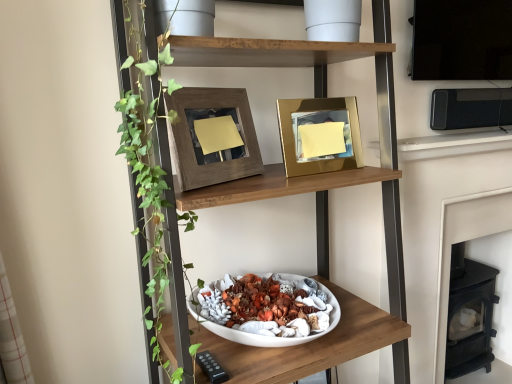
How much space does wooden bowl at center, marked as the first shelf in a top-to-bottom arrangement, occupy horizontally?

wooden bowl at center, marked as the first shelf in a top-to-bottom arrangement, is 19.04 inches wide.

Locate an element on the screen. The image size is (512, 384). wooden frame at upper center, which appears as the second picture frame when viewed from the right is located at coordinates (191, 139).

What do you see at coordinates (191, 139) in the screenshot?
I see `wooden frame at upper center, which ranks as the first picture frame in left-to-right order` at bounding box center [191, 139].

Describe the element at coordinates (470, 108) in the screenshot. I see `black plastic microwave at upper right` at that location.

This screenshot has height=384, width=512. Identify the location of gold metallic picture frame at upper center, the second picture frame when ordered from left to right. pyautogui.click(x=319, y=135).

Can you confirm if black cast iron fireplace at lower right is thinner than wooden bowl at center, marked as the first shelf in a top-to-bottom arrangement?

Yes.

Between black cast iron fireplace at lower right and wooden bowl at center, marked as the first shelf in a top-to-bottom arrangement, which one appears on the left side from the viewer's perspective?

wooden bowl at center, marked as the first shelf in a top-to-bottom arrangement, is more to the left.

Is black cast iron fireplace at lower right positioned beyond the bounds of wooden bowl at center, which is counted as the second shelf, starting from the bottom?

Absolutely, black cast iron fireplace at lower right is external to wooden bowl at center, which is counted as the second shelf, starting from the bottom.

Is black cast iron fireplace at lower right taller or shorter than wooden bowl at center, marked as the first shelf in a top-to-bottom arrangement?

Clearly, black cast iron fireplace at lower right is shorter compared to wooden bowl at center, marked as the first shelf in a top-to-bottom arrangement.

Considering the sizes of gold metallic picture frame at upper center, the second picture frame when ordered from left to right, and white matte bowl at center, which appears as the second shelf when viewed from the top, in the image, is gold metallic picture frame at upper center, the second picture frame when ordered from left to right, bigger or smaller than white matte bowl at center, which appears as the second shelf when viewed from the top,?

Considering their sizes, gold metallic picture frame at upper center, the second picture frame when ordered from left to right, takes up less space than white matte bowl at center, which appears as the second shelf when viewed from the top.

Would you say gold metallic picture frame at upper center, the first picture frame positioned from the right, is to the left or to the right of white matte bowl at center, which appears as the second shelf when viewed from the top, in the picture?

From the image, it's evident that gold metallic picture frame at upper center, the first picture frame positioned from the right, is to the right of white matte bowl at center, which appears as the second shelf when viewed from the top.

Is gold metallic picture frame at upper center, the first picture frame positioned from the right, wider than white matte bowl at center, which is counted as the first shelf, starting from the bottom?

No.

Can you tell me how much gold metallic picture frame at upper center, the second picture frame when ordered from left to right, and white matte bowl at center, which appears as the second shelf when viewed from the top, differ in facing direction?

The angle between the facing direction of gold metallic picture frame at upper center, the second picture frame when ordered from left to right, and the facing direction of white matte bowl at center, which appears as the second shelf when viewed from the top, is 3.2 degrees.

Which is more to the right, wooden frame at upper center, which appears as the second picture frame when viewed from the right, or gold metallic picture frame at upper center, the second picture frame when ordered from left to right?

gold metallic picture frame at upper center, the second picture frame when ordered from left to right, is more to the right.

Does wooden frame at upper center, which appears as the second picture frame when viewed from the right, have a lesser width compared to gold metallic picture frame at upper center, the second picture frame when ordered from left to right?

Yes.

From the image's perspective, which one is positioned lower, wooden frame at upper center, which appears as the second picture frame when viewed from the right, or gold metallic picture frame at upper center, the second picture frame when ordered from left to right?

From the image's view, wooden frame at upper center, which appears as the second picture frame when viewed from the right, is below.

From a real-world perspective, is wooden frame at upper center, which ranks as the first picture frame in left-to-right order, positioned over gold metallic picture frame at upper center, the first picture frame positioned from the right, based on gravity?

Yes, from a real-world perspective, wooden frame at upper center, which ranks as the first picture frame in left-to-right order, is on top of gold metallic picture frame at upper center, the first picture frame positioned from the right.

Is gold metallic picture frame at upper center, the second picture frame when ordered from left to right, surrounding wooden frame at upper center, which ranks as the first picture frame in left-to-right order?

No, wooden frame at upper center, which ranks as the first picture frame in left-to-right order, is not a part of gold metallic picture frame at upper center, the second picture frame when ordered from left to right.

Is gold metallic picture frame at upper center, the second picture frame when ordered from left to right, thinner than wooden frame at upper center, which appears as the second picture frame when viewed from the right?

In fact, gold metallic picture frame at upper center, the second picture frame when ordered from left to right, might be wider than wooden frame at upper center, which appears as the second picture frame when viewed from the right.

Considering the sizes of gold metallic picture frame at upper center, the first picture frame positioned from the right, and wooden frame at upper center, which ranks as the first picture frame in left-to-right order, in the image, is gold metallic picture frame at upper center, the first picture frame positioned from the right, bigger or smaller than wooden frame at upper center, which ranks as the first picture frame in left-to-right order,?

In the image, gold metallic picture frame at upper center, the first picture frame positioned from the right, appears to be smaller than wooden frame at upper center, which ranks as the first picture frame in left-to-right order.

Would you say gold metallic picture frame at upper center, the second picture frame when ordered from left to right, is to the left or to the right of wooden frame at upper center, which ranks as the first picture frame in left-to-right order, in the picture?

Based on their positions, gold metallic picture frame at upper center, the second picture frame when ordered from left to right, is located to the right of wooden frame at upper center, which ranks as the first picture frame in left-to-right order.

Is wooden bowl at center, which is counted as the second shelf, starting from the bottom, not inside wooden frame at upper center, which appears as the second picture frame when viewed from the right?

Indeed, wooden bowl at center, which is counted as the second shelf, starting from the bottom, is completely outside wooden frame at upper center, which appears as the second picture frame when viewed from the right.

Is wooden bowl at center, which is counted as the second shelf, starting from the bottom, oriented towards wooden frame at upper center, which ranks as the first picture frame in left-to-right order?

Yes, wooden bowl at center, which is counted as the second shelf, starting from the bottom, is turned towards wooden frame at upper center, which ranks as the first picture frame in left-to-right order.

Looking at their sizes, would you say wooden bowl at center, which is counted as the second shelf, starting from the bottom, is wider or thinner than wooden frame at upper center, which appears as the second picture frame when viewed from the right?

In the image, wooden bowl at center, which is counted as the second shelf, starting from the bottom, appears to be wider than wooden frame at upper center, which appears as the second picture frame when viewed from the right.

Is wooden bowl at center, marked as the first shelf in a top-to-bottom arrangement, bigger than wooden frame at upper center, which appears as the second picture frame when viewed from the right?

Yes, wooden bowl at center, marked as the first shelf in a top-to-bottom arrangement, is bigger than wooden frame at upper center, which appears as the second picture frame when viewed from the right.

Find the location of a particular element. The width and height of the screenshot is (512, 384). picture frame that is the 2nd one above the white matte bowl at center, which is counted as the first shelf, starting from the bottom (from a real-world perspective) is located at coordinates (191, 139).

From a real-world perspective, is white matte bowl at center, which appears as the second shelf when viewed from the top, above or below wooden frame at upper center, which ranks as the first picture frame in left-to-right order?

white matte bowl at center, which appears as the second shelf when viewed from the top, is below wooden frame at upper center, which ranks as the first picture frame in left-to-right order.

From the image's perspective, between white matte bowl at center, which appears as the second shelf when viewed from the top, and wooden frame at upper center, which appears as the second picture frame when viewed from the right, which one is located above?

wooden frame at upper center, which appears as the second picture frame when viewed from the right, appears higher in the image.

Does point (283, 361) appear closer or farther from the camera than point (229, 165)?

Clearly, point (283, 361) is closer to the camera than point (229, 165).

Could you measure the distance between black plastic microwave at upper right and white matte bowl at center, which appears as the second shelf when viewed from the top?

black plastic microwave at upper right is 87.21 centimeters from white matte bowl at center, which appears as the second shelf when viewed from the top.

In the image, is black plastic microwave at upper right on the left side or the right side of white matte bowl at center, which appears as the second shelf when viewed from the top?

black plastic microwave at upper right is to the right of white matte bowl at center, which appears as the second shelf when viewed from the top.

Are black plastic microwave at upper right and white matte bowl at center, which appears as the second shelf when viewed from the top, beside each other?

No, black plastic microwave at upper right is not with white matte bowl at center, which appears as the second shelf when viewed from the top.

Do you think black plastic microwave at upper right is within white matte bowl at center, which is counted as the first shelf, starting from the bottom, or outside of it?

black plastic microwave at upper right is located beyond the bounds of white matte bowl at center, which is counted as the first shelf, starting from the bottom.

Locate an element on the screen. This screenshot has width=512, height=384. fireplace that is behind the wooden bowl at center, marked as the first shelf in a top-to-bottom arrangement is located at coordinates 465,240.

I want to click on the 2nd shelf directly beneath the gold metallic picture frame at upper center, the first picture frame positioned from the right (from a real-world perspective), so click(x=307, y=343).

Considering their positions, is wooden bowl at center, marked as the first shelf in a top-to-bottom arrangement, positioned closer to wooden frame at upper center, which ranks as the first picture frame in left-to-right order, than white matte bowl at center, which appears as the second shelf when viewed from the top?

wooden bowl at center, marked as the first shelf in a top-to-bottom arrangement, is closer to wooden frame at upper center, which ranks as the first picture frame in left-to-right order.

Based on their spatial positions, is white matte bowl at center, which appears as the second shelf when viewed from the top, or wooden bowl at center, which is counted as the second shelf, starting from the bottom, further from black plastic microwave at upper right?

white matte bowl at center, which appears as the second shelf when viewed from the top.

Estimate the real-world distances between objects in this image. Which object is closer to wooden bowl at center, which is counted as the second shelf, starting from the bottom, wooden frame at upper center, which appears as the second picture frame when viewed from the right, or gold metallic picture frame at upper center, the second picture frame when ordered from left to right?

wooden frame at upper center, which appears as the second picture frame when viewed from the right, lies closer to wooden bowl at center, which is counted as the second shelf, starting from the bottom, than the other object.

Considering their positions, is white matte bowl at center, which appears as the second shelf when viewed from the top, positioned closer to wooden frame at upper center, which ranks as the first picture frame in left-to-right order, than black cast iron fireplace at lower right?

white matte bowl at center, which appears as the second shelf when viewed from the top, lies closer to wooden frame at upper center, which ranks as the first picture frame in left-to-right order, than the other object.

Which object lies further to the anchor point black plastic microwave at upper right, wooden frame at upper center, which appears as the second picture frame when viewed from the right, or gold metallic picture frame at upper center, the second picture frame when ordered from left to right?

wooden frame at upper center, which appears as the second picture frame when viewed from the right, is positioned further to the anchor black plastic microwave at upper right.

Estimate the real-world distances between objects in this image. Which object is closer to gold metallic picture frame at upper center, the first picture frame positioned from the right, wooden frame at upper center, which appears as the second picture frame when viewed from the right, or wooden bowl at center, which is counted as the second shelf, starting from the bottom?

wooden frame at upper center, which appears as the second picture frame when viewed from the right, is positioned closer to the anchor gold metallic picture frame at upper center, the first picture frame positioned from the right.

Estimate the real-world distances between objects in this image. Which object is closer to wooden frame at upper center, which ranks as the first picture frame in left-to-right order, wooden bowl at center, which is counted as the second shelf, starting from the bottom, or gold metallic picture frame at upper center, the second picture frame when ordered from left to right?

Based on the image, wooden bowl at center, which is counted as the second shelf, starting from the bottom, appears to be nearer to wooden frame at upper center, which ranks as the first picture frame in left-to-right order.

Looking at this image, looking at the image, which one is located further to wooden bowl at center, which is counted as the second shelf, starting from the bottom, white matte bowl at center, which is counted as the first shelf, starting from the bottom, or black cast iron fireplace at lower right?

black cast iron fireplace at lower right is further to wooden bowl at center, which is counted as the second shelf, starting from the bottom.

The height and width of the screenshot is (384, 512). Find the location of `shelf between wooden bowl at center, which is counted as the second shelf, starting from the bottom, and black cast iron fireplace at lower right in the front-back direction`. shelf between wooden bowl at center, which is counted as the second shelf, starting from the bottom, and black cast iron fireplace at lower right in the front-back direction is located at coordinates (307, 343).

Where is `shelf between wooden frame at upper center, which ranks as the first picture frame in left-to-right order, and white matte bowl at center, which is counted as the first shelf, starting from the bottom, vertically`? This screenshot has width=512, height=384. shelf between wooden frame at upper center, which ranks as the first picture frame in left-to-right order, and white matte bowl at center, which is counted as the first shelf, starting from the bottom, vertically is located at coordinates (348, 185).

Locate an element on the screen. appliance between white matte bowl at center, which appears as the second shelf when viewed from the top, and black cast iron fireplace at lower right, in the horizontal direction is located at coordinates (470, 108).

I want to click on picture frame between wooden frame at upper center, which appears as the second picture frame when viewed from the right, and black plastic microwave at upper right from left to right, so click(319, 135).